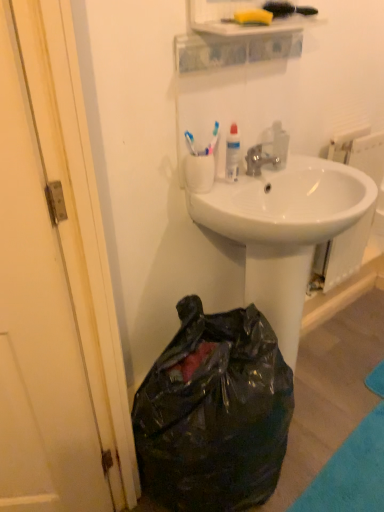
You are a GUI agent. You are given a task and a screenshot of the screen. Output one action in this format:
    pyautogui.click(x=<x>, y=<y>)
    Task: Click on the free point in front of silver metallic faucet at center
    The width and height of the screenshot is (384, 512).
    Given the screenshot: What is the action you would take?
    pyautogui.click(x=237, y=192)